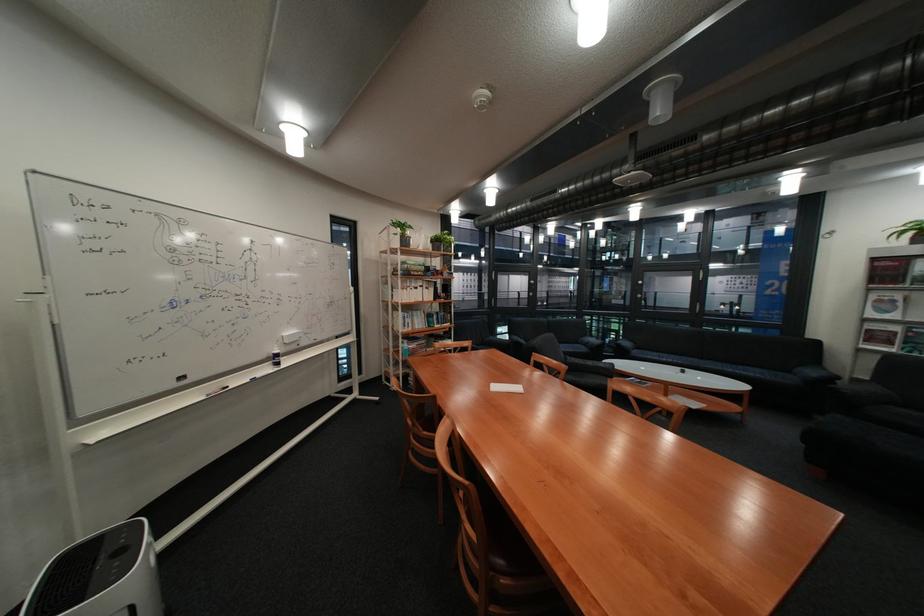
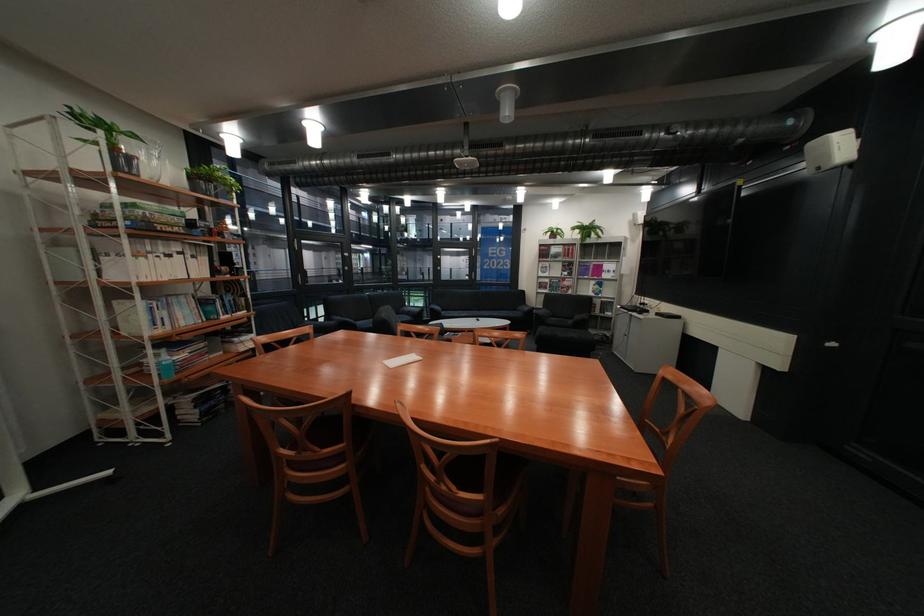
Where in the second image is the point corresponding to (416,341) from the first image?

(165, 351)